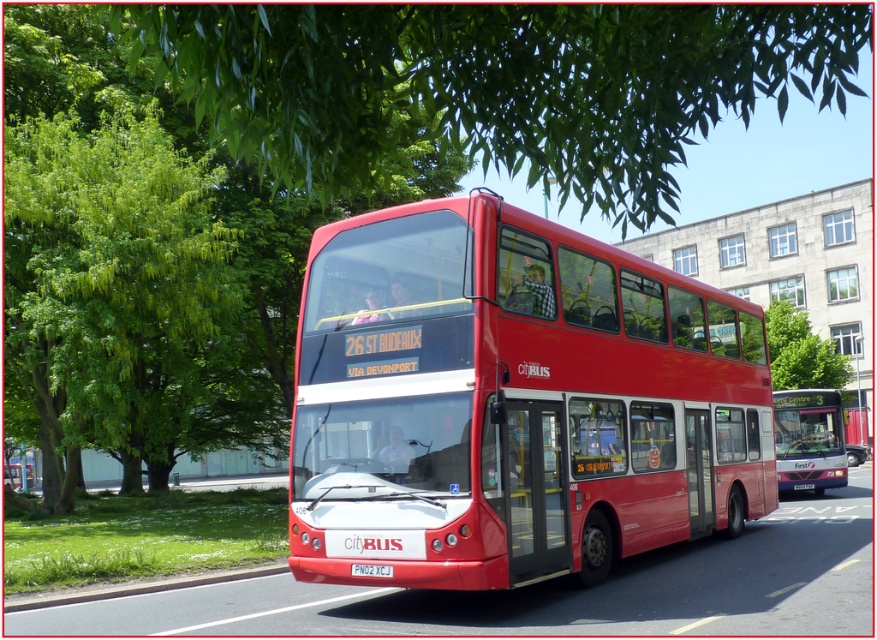
Does point (215, 116) lie behind point (826, 486)?

No, it is not.

Where is `green leafy tree at upper center`? Image resolution: width=877 pixels, height=640 pixels. green leafy tree at upper center is located at coordinates (496, 84).

Locate an element on the screen. The width and height of the screenshot is (877, 640). green leafy tree at upper center is located at coordinates (496, 84).

Is the position of shiny red bus at center less distant than that of white plastic license plate at center?

Yes, it is.

Where is `shiny red bus at center`? The height and width of the screenshot is (640, 877). shiny red bus at center is located at coordinates (512, 401).

Which is more to the left, shiny red bus at center or green leafy tree at upper center?

From the viewer's perspective, shiny red bus at center appears more on the left side.

Between shiny red bus at center and green leafy tree at upper center, which one is positioned lower?

Positioned lower is shiny red bus at center.

Does point (726, 305) lie behind point (376, 152)?

Yes, point (726, 305) is behind point (376, 152).

Find the location of `shiny red bus at center`. shiny red bus at center is located at coordinates (512, 401).